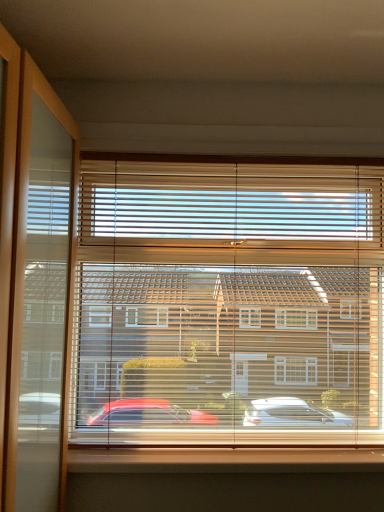
What is the approximate width of smooth wood window sill at lower center?

It is 5.09 inches.

At what (x,y) coordinates should I click in order to perform the action: click on smooth wood window sill at lower center. Please return your answer as a coordinate pair (x, y). This screenshot has width=384, height=512. Looking at the image, I should click on (224, 459).

Measure the distance between smooth wood window sill at lower center and camera.

smooth wood window sill at lower center and camera are 1.37 meters apart.

Image resolution: width=384 pixels, height=512 pixels. Describe the element at coordinates (224, 459) in the screenshot. I see `smooth wood window sill at lower center` at that location.

The width and height of the screenshot is (384, 512). Describe the element at coordinates (228, 304) in the screenshot. I see `wooden blinds at center` at that location.

This screenshot has height=512, width=384. Find the location of `wooden blinds at center`. wooden blinds at center is located at coordinates (228, 304).

The height and width of the screenshot is (512, 384). Identify the location of smooth wood window sill at lower center. (224, 459).

Is wooden blinds at center to the left or to the right of smooth wood window sill at lower center in the image?

Based on their positions, wooden blinds at center is located to the right of smooth wood window sill at lower center.

Which object is closer to the camera, wooden blinds at center or smooth wood window sill at lower center?

Positioned in front is smooth wood window sill at lower center.

Between point (222, 433) and point (180, 468), which one is positioned in front?

Point (180, 468)

From the image's perspective, does wooden blinds at center appear higher than smooth wood window sill at lower center?

Yes, from the image's perspective, wooden blinds at center is on top of smooth wood window sill at lower center.

From a real-world perspective, who is located lower, wooden blinds at center or smooth wood window sill at lower center?

From a 3D spatial view, smooth wood window sill at lower center is below.

Which object is thinner, wooden blinds at center or smooth wood window sill at lower center?

Thinner between the two is wooden blinds at center.

Between wooden blinds at center and smooth wood window sill at lower center, which one has more height?

With more height is wooden blinds at center.

Based on their sizes in the image, would you say wooden blinds at center is bigger or smaller than smooth wood window sill at lower center?

Clearly, wooden blinds at center is larger in size than smooth wood window sill at lower center.

Is wooden blinds at center located outside smooth wood window sill at lower center?

That's correct, wooden blinds at center is outside of smooth wood window sill at lower center.

Is wooden blinds at center far from smooth wood window sill at lower center?

Actually, wooden blinds at center and smooth wood window sill at lower center are a little close together.

Looking at this image, is wooden blinds at center oriented towards smooth wood window sill at lower center?

Yes.

What's the angular difference between wooden blinds at center and smooth wood window sill at lower center's facing directions?

wooden blinds at center and smooth wood window sill at lower center are facing 0.00206 degrees away from each other.

How distant is wooden blinds at center from smooth wood window sill at lower center?

17.92 inches.

Find the location of a particular element. window blind that appears above the smooth wood window sill at lower center (from a real-world perspective) is located at coordinates (228, 304).

Is smooth wood window sill at lower center to the left or to the right of wooden blinds at center in the image?

Based on their positions, smooth wood window sill at lower center is located to the left of wooden blinds at center.

Is smooth wood window sill at lower center positioned behind wooden blinds at center?

No, it is in front of wooden blinds at center.

Is point (121, 454) closer or farther from the camera than point (251, 178)?

Point (121, 454) is closer to the camera than point (251, 178).

From the image's perspective, between smooth wood window sill at lower center and wooden blinds at center, which one is located above?

wooden blinds at center, from the image's perspective.

From a real-world perspective, is smooth wood window sill at lower center physically located above or below wooden blinds at center?

In terms of real-world spatial position, smooth wood window sill at lower center is below wooden blinds at center.

Based on the photo, considering the relative sizes of smooth wood window sill at lower center and wooden blinds at center in the image provided, is smooth wood window sill at lower center thinner than wooden blinds at center?

No.

Which of these two, smooth wood window sill at lower center or wooden blinds at center, stands shorter?

Standing shorter between the two is smooth wood window sill at lower center.

Looking at the image, does smooth wood window sill at lower center seem bigger or smaller compared to wooden blinds at center?

Considering their sizes, smooth wood window sill at lower center takes up less space than wooden blinds at center.

Looking at this image, is wooden blinds at center completely or partially inside smooth wood window sill at lower center?

No, wooden blinds at center is located outside of smooth wood window sill at lower center.

Is smooth wood window sill at lower center touching wooden blinds at center?

No, smooth wood window sill at lower center is not touching wooden blinds at center.

Is smooth wood window sill at lower center turned away from wooden blinds at center?

Yes, smooth wood window sill at lower center's orientation is away from wooden blinds at center.

The image size is (384, 512). What are the coordinates of `window sill lying on the left of wooden blinds at center` in the screenshot? It's located at (224, 459).

I want to click on window blind behind the smooth wood window sill at lower center, so click(228, 304).

Locate an element on the screen. Image resolution: width=384 pixels, height=512 pixels. window blind above the smooth wood window sill at lower center (from the image's perspective) is located at coordinates (228, 304).